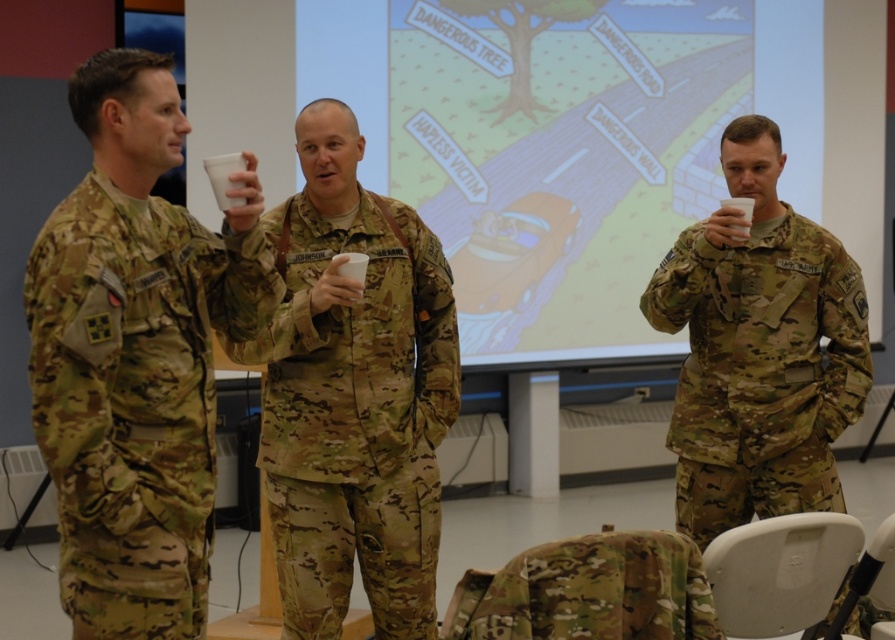
Based on the scene description, which object is positioned higher up in the image between the matte plastic projection screen at center and the camouflage uniform at center?

The matte plastic projection screen at center is positioned higher up than the camouflage uniform at center in the image.

You are a drone operator controlling a drone that needs to fly to point A at point (657, 3). The drone has a maximum flight distance of 6 meters. Will the drone be able to reach point A?

The distance between point A at point (657, 3) and the camera is 5.85 meters. Since the drone can fly up to 6 meters, it can reach point A.